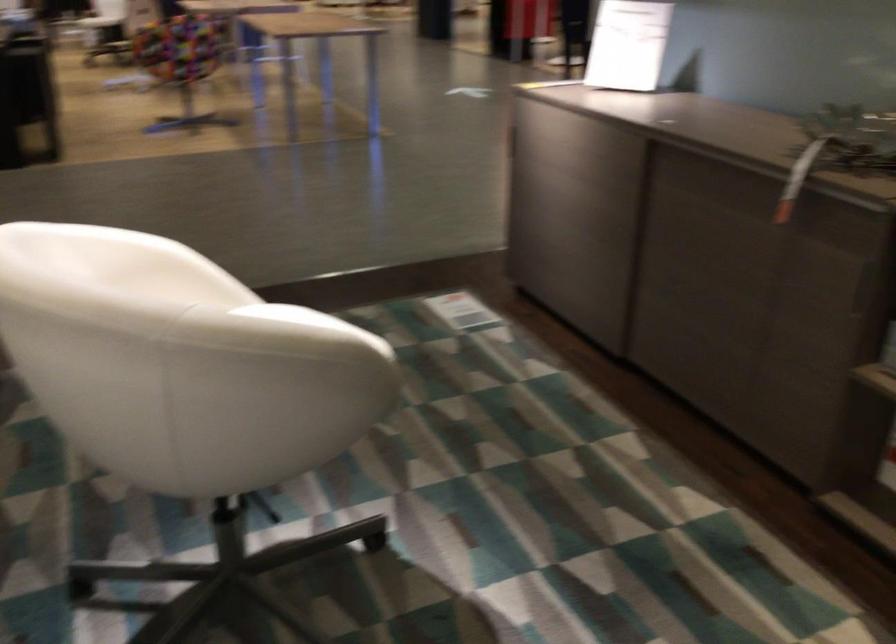
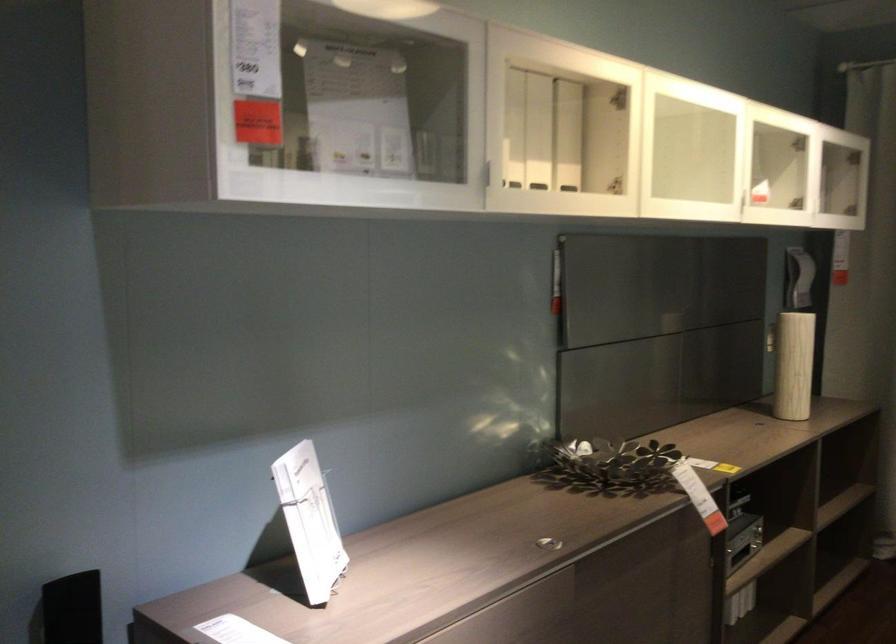
Locate, in the second image, the point that corresponds to (676,128) in the first image.

(547, 543)